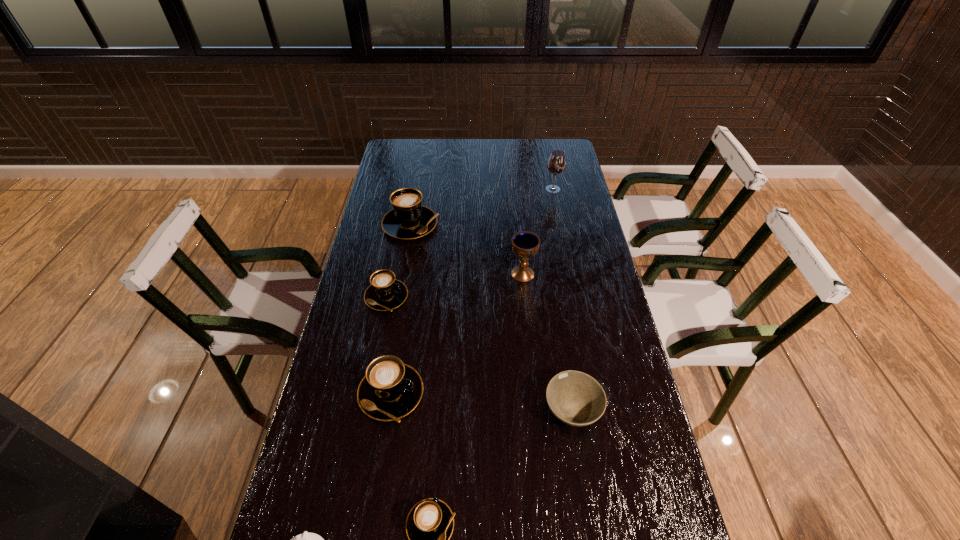
In order to click on free region located on the back of the chalice in this screenshot , I will do `click(520, 245)`.

The image size is (960, 540). I want to click on blank area located 0.210m on the back of the seventh nearest object, so click(x=419, y=178).

Image resolution: width=960 pixels, height=540 pixels. Identify the location of blank area located on the right of the third farthest cappuccino. (564, 394).

The width and height of the screenshot is (960, 540). I want to click on free space located 0.360m on the right of the second farthest black cappuccino, so click(x=519, y=297).

Image resolution: width=960 pixels, height=540 pixels. I want to click on free space located 0.380m on the left of the bowl, so click(x=397, y=411).

Identify the location of wineglass positioned at the right edge. The height and width of the screenshot is (540, 960). (556, 163).

Find the location of `bowl that is at the right edge`. bowl that is at the right edge is located at coordinates (575, 398).

Where is `vacant space at the far edge of the desktop`? vacant space at the far edge of the desktop is located at coordinates (426, 139).

Find the location of a particular element. The image size is (960, 540). vacant area at the left edge of the desktop is located at coordinates (339, 383).

Where is `free spot at the right edge of the desktop`? free spot at the right edge of the desktop is located at coordinates (600, 263).